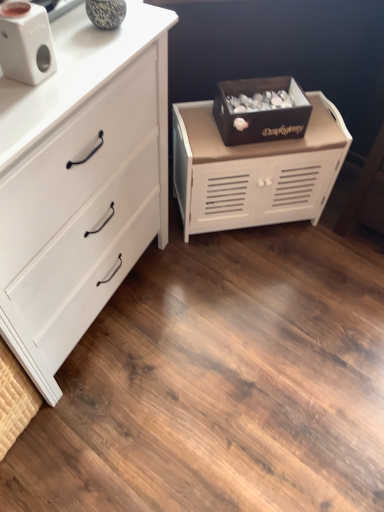
The image size is (384, 512). In order to click on free space in front of white matte speaker at upper left in this screenshot , I will do `click(25, 101)`.